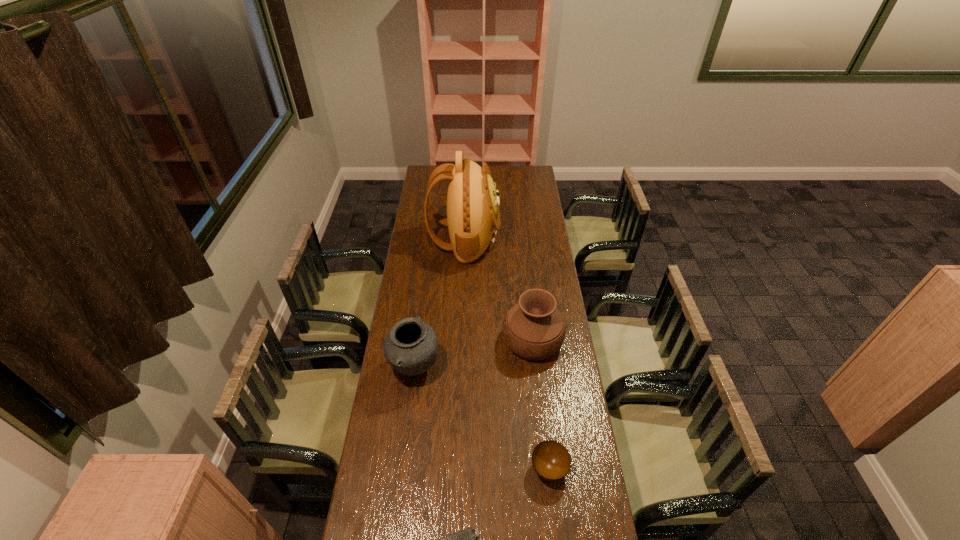
Where is `backpack that is at the left edge`? backpack that is at the left edge is located at coordinates (473, 217).

I want to click on urn that is positioned at the left edge, so click(411, 346).

Where is `urn that is at the right edge`? The height and width of the screenshot is (540, 960). urn that is at the right edge is located at coordinates (534, 329).

Where is `bowl present at the right edge`? This screenshot has width=960, height=540. bowl present at the right edge is located at coordinates (551, 460).

I want to click on free space at the far edge of the desktop, so click(497, 173).

The width and height of the screenshot is (960, 540). In order to click on vacant space at the left edge of the desktop in this screenshot , I will do `click(405, 303)`.

I want to click on vacant space at the right edge, so coord(524,219).

Locate an element on the screen. The height and width of the screenshot is (540, 960). free space between the farthest object and the left urn is located at coordinates (440, 303).

Identify the location of blank region between the left urn and the right urn. (474, 354).

Identify the location of vacant space that is in between the right urn and the farthest object. This screenshot has height=540, width=960. (498, 290).